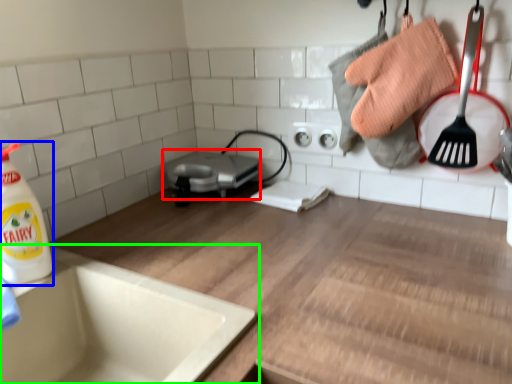
Question: Estimate the real-world distances between objects in this image. Which object is closer to appliance (highlighted by a red box), cleaning product (highlighted by a blue box) or sink (highlighted by a green box)?

Choices:
 (A) cleaning product
 (B) sink

Answer: (B)